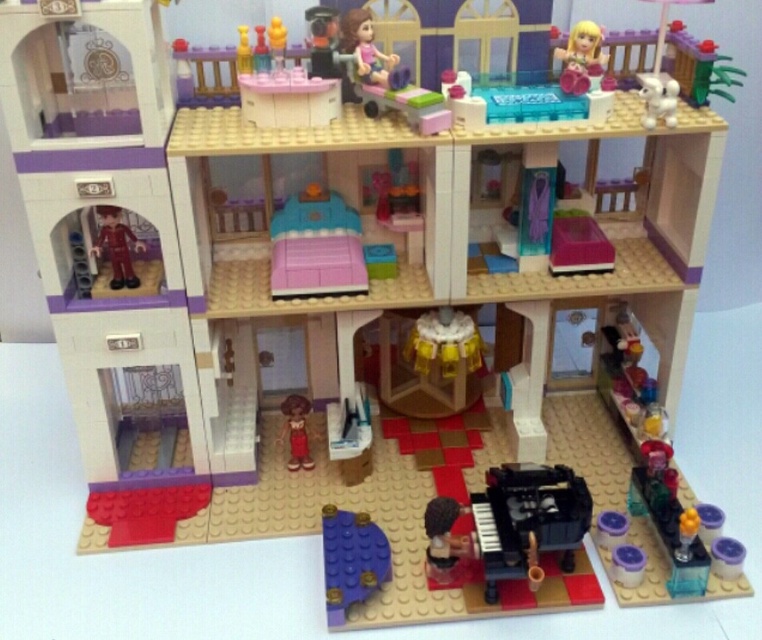
Question: Does blonde hair doll at upper center appear on the left side of translucent blue plastic vase at upper center?

Choices:
 (A) yes
 (B) no

Answer: (B)

Question: Considering the real-world distances, which object is closest to the shiny red suit at left?

Choices:
 (A) smooth brown hair at lower center
 (B) pink matte bed at center

Answer: (B)

Question: Which of these objects is positioned farthest from the matte pink dress at upper center?

Choices:
 (A) matte brown doll at center
 (B) purple matte plate at lower center

Answer: (B)

Question: Which of these objects is positioned closest to the matte brown doll at center?

Choices:
 (A) matte pink dress at upper center
 (B) blonde hair doll at upper center

Answer: (A)

Question: Does purple matte plate at lower center have a greater width compared to blonde hair doll at upper center?

Choices:
 (A) yes
 (B) no

Answer: (A)

Question: Is smooth brown hair at lower center to the right of matte pink dress at upper center from the viewer's perspective?

Choices:
 (A) yes
 (B) no

Answer: (A)